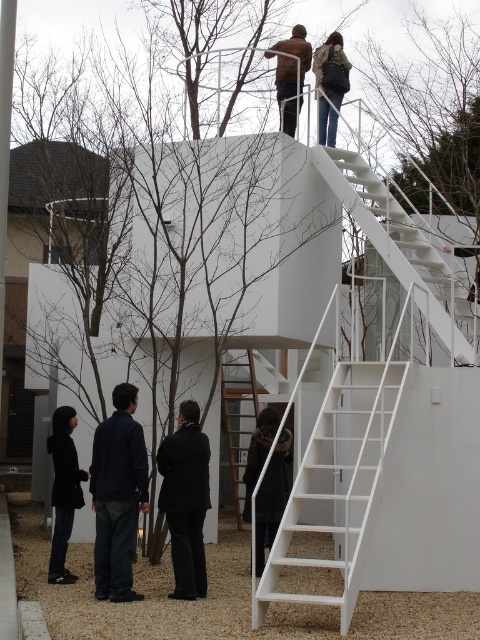
Question: Among these points, which one is farthest from the camera?

Choices:
 (A) coord(52,417)
 (B) coord(260,452)

Answer: (A)

Question: Does dark blue jacket at lower left lie in front of brown leather jacket at upper center?

Choices:
 (A) yes
 (B) no

Answer: (A)

Question: In this image, where is matte black backpack at upper center located relative to brown leather jacket at upper center?

Choices:
 (A) below
 (B) above

Answer: (A)

Question: Which point is farther from the camera taking this photo?

Choices:
 (A) (267, 420)
 (B) (325, 472)

Answer: (B)

Question: Which point is farther from the camera taking this photo?

Choices:
 (A) (240, 448)
 (B) (290, 93)
 (C) (279, 458)
 (D) (100, 476)

Answer: (A)

Question: Can you confirm if white matte staircase at lower right is thinner than dark blue jacket at lower left?

Choices:
 (A) no
 (B) yes

Answer: (A)